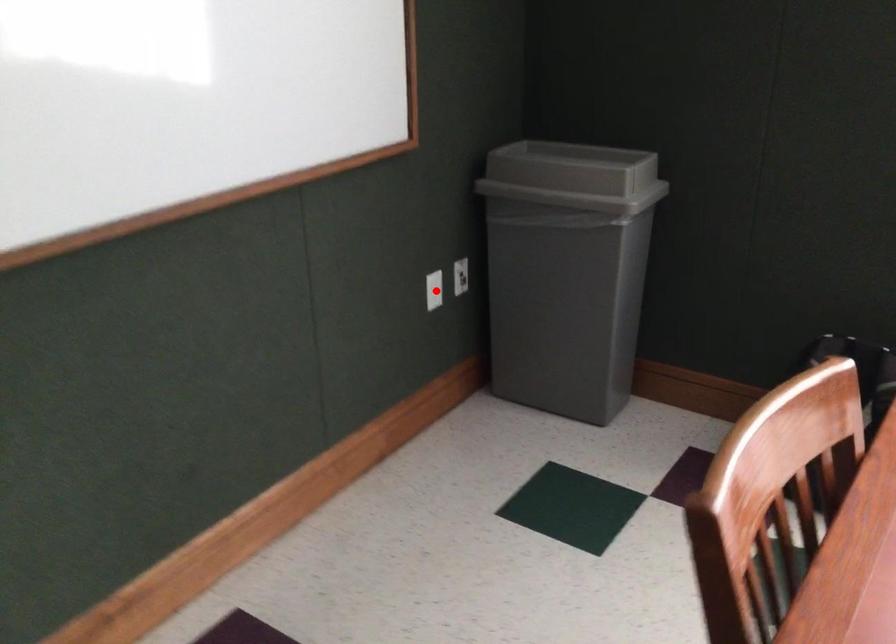
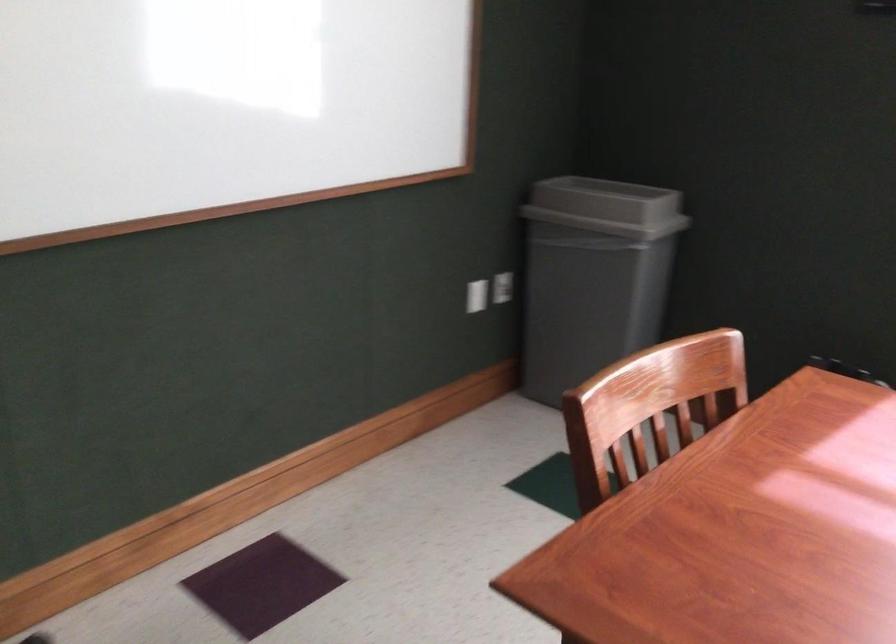
Question: I am providing you with two images of the same scene from different viewpoints. Image1 has a red point marked. In image2, the corresponding 3D location appears at what relative position? Reply with the corresponding letter.

Choices:
 (A) Closer
 (B) Farther

Answer: (B)